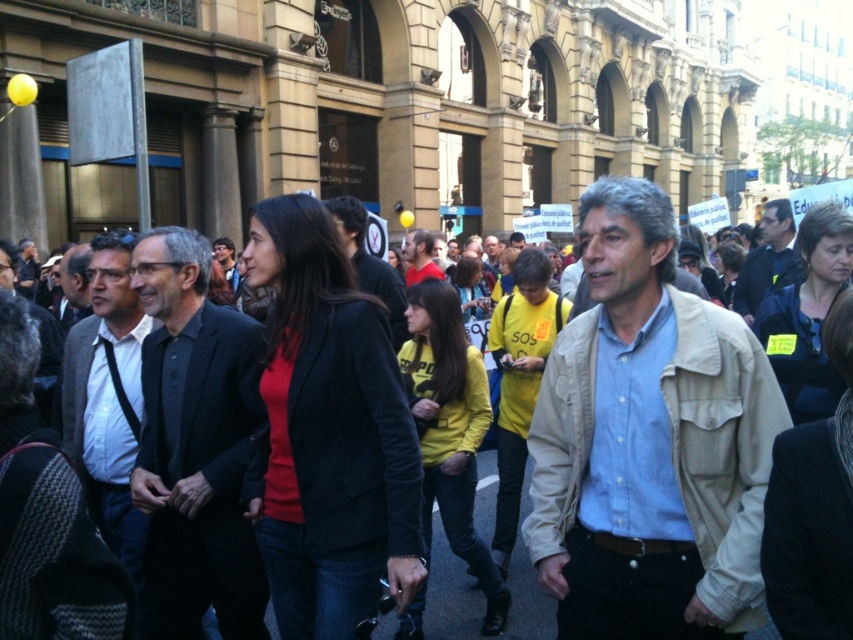
Does dark gray suit at left have a larger size compared to matte red shirt at center?

Yes, dark gray suit at left is bigger than matte red shirt at center.

Does dark gray suit at left have a smaller size compared to matte red shirt at center?

No, dark gray suit at left is not smaller than matte red shirt at center.

This screenshot has height=640, width=853. What are the coordinates of `dark gray suit at left` in the screenshot? It's located at 107,396.

Where is `dark gray suit at left`? This screenshot has height=640, width=853. dark gray suit at left is located at coordinates (107, 396).

Does beige textured jacket at center appear under yellow shirt at center?

Yes.

Who is positioned more to the right, beige textured jacket at center or yellow shirt at center?

beige textured jacket at center

Which is behind, point (582, 378) or point (483, 244)?

Point (483, 244)

Locate an element on the screen. beige textured jacket at center is located at coordinates (648, 442).

Can you confirm if light beige jacket at center is positioned below dark blue shirt at center?

Yes.

Which is behind, point (457, 573) or point (784, 204)?

Positioned behind is point (784, 204).

I want to click on light beige jacket at center, so (x=450, y=595).